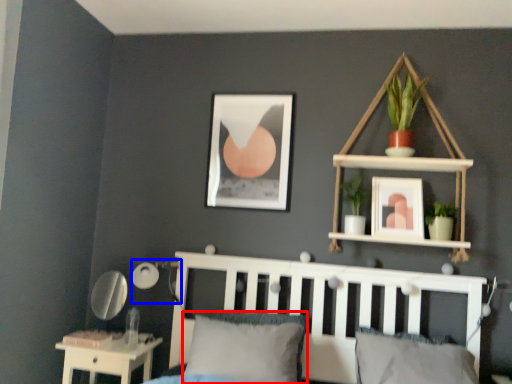
Question: Which object is further to the camera taking this photo, pillow (highlighted by a red box) or lamp (highlighted by a blue box)?

Choices:
 (A) pillow
 (B) lamp

Answer: (B)